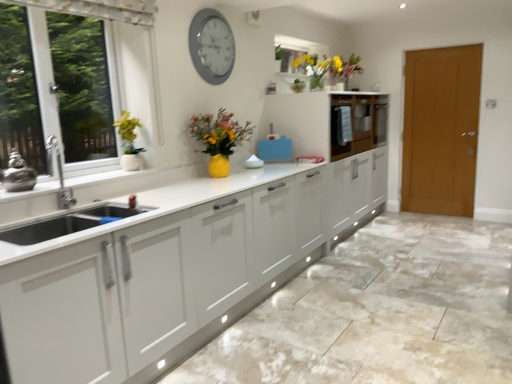
Question: From a real-world perspective, is matte white cabinet at center, arranged as the second cabinetry when viewed from the front, over white marble granite at lower center?

Choices:
 (A) no
 (B) yes

Answer: (B)

Question: Can you confirm if matte white cabinet at center, arranged as the second cabinetry when viewed from the front, is smaller than white marble granite at lower center?

Choices:
 (A) no
 (B) yes

Answer: (B)

Question: Can you confirm if matte white cabinet at center, the 1th cabinetry positioned from the back, is positioned to the right of white marble granite at lower center?

Choices:
 (A) yes
 (B) no

Answer: (A)

Question: Is matte white cabinet at center, arranged as the second cabinetry when viewed from the front, placed right next to white marble granite at lower center?

Choices:
 (A) no
 (B) yes

Answer: (A)

Question: Is matte white cabinet at center, the 1th cabinetry positioned from the back, far from white marble granite at lower center?

Choices:
 (A) yes
 (B) no

Answer: (A)

Question: From a real-world perspective, is silver metallic clock at upper center above or below brown wooden door at right?

Choices:
 (A) above
 (B) below

Answer: (A)

Question: From the image's perspective, is silver metallic clock at upper center positioned above or below brown wooden door at right?

Choices:
 (A) below
 (B) above

Answer: (B)

Question: Based on their positions, is silver metallic clock at upper center located to the left or right of brown wooden door at right?

Choices:
 (A) right
 (B) left

Answer: (B)

Question: Would you say silver metallic clock at upper center is inside or outside brown wooden door at right?

Choices:
 (A) outside
 (B) inside

Answer: (A)

Question: From a real-world perspective, is brown wooden door at right physically located above or below yellow matte vase at upper center?

Choices:
 (A) below
 (B) above

Answer: (A)

Question: Considering the positions of brown wooden door at right and yellow matte vase at upper center in the image, is brown wooden door at right bigger or smaller than yellow matte vase at upper center?

Choices:
 (A) big
 (B) small

Answer: (A)

Question: Choose the correct answer: Is brown wooden door at right inside yellow matte vase at upper center or outside it?

Choices:
 (A) outside
 (B) inside

Answer: (A)

Question: From the image's perspective, is brown wooden door at right located above or below yellow matte vase at upper center?

Choices:
 (A) below
 (B) above

Answer: (A)

Question: Relative to white marble granite at lower center, is matte white cabinet at center, marked as the first cabinetry in a front-to-back arrangement, in front or behind?

Choices:
 (A) behind
 (B) front

Answer: (A)

Question: From a real-world perspective, is matte white cabinet at center, which is the 2th cabinetry in back-to-front order, physically located above or below white marble granite at lower center?

Choices:
 (A) below
 (B) above

Answer: (B)